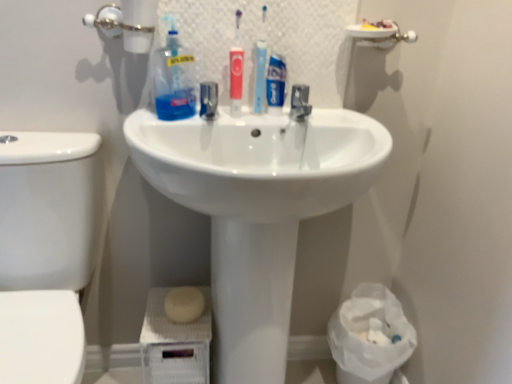
The width and height of the screenshot is (512, 384). What do you see at coordinates (370, 336) in the screenshot? I see `white plastic bag at lower right` at bounding box center [370, 336].

Locate an element on the screen. The width and height of the screenshot is (512, 384). transparent plastic toothbrushes at upper center is located at coordinates (268, 41).

The image size is (512, 384). What do you see at coordinates (175, 343) in the screenshot?
I see `white matte soap at lower center` at bounding box center [175, 343].

Locate an element on the screen. metallic faucet at center is located at coordinates (300, 103).

Image resolution: width=512 pixels, height=384 pixels. What are the coordinates of `white glossy sink at center` in the screenshot? It's located at (257, 210).

Where is `white plastic bag at lower right`? The width and height of the screenshot is (512, 384). white plastic bag at lower right is located at coordinates (370, 336).

From a real-world perspective, is transparent plastic toothbrushes at upper center physically located above or below translucent plastic bottle at upper center?

Clearly, from a real-world perspective, transparent plastic toothbrushes at upper center is above translucent plastic bottle at upper center.

Is point (288, 72) behind point (176, 100)?

Yes, it is behind point (176, 100).

Between transparent plastic toothbrushes at upper center and translucent plastic bottle at upper center, which one has larger width?

Wider between the two is translucent plastic bottle at upper center.

Considering the relative sizes of transparent plastic toothbrushes at upper center and translucent plastic bottle at upper center in the image provided, is transparent plastic toothbrushes at upper center shorter than translucent plastic bottle at upper center?

→ In fact, transparent plastic toothbrushes at upper center may be taller than translucent plastic bottle at upper center.

Is white glossy sink at center at the back of transparent plastic toothbrushes at upper center?

No.

Is transparent plastic toothbrushes at upper center far away from white glossy sink at center?

transparent plastic toothbrushes at upper center is actually quite close to white glossy sink at center.

Does transparent plastic toothbrushes at upper center contain white glossy sink at center?

That's incorrect, white glossy sink at center is not inside transparent plastic toothbrushes at upper center.

Between transparent plastic toothbrushes at upper center and white glossy sink at center, which one has larger size?

white glossy sink at center is bigger.

From the image's perspective, which is below, blue matte toothpaste tube at center or matte red toothbrush at center?

blue matte toothpaste tube at center is shown below in the image.

Can you confirm if blue matte toothpaste tube at center is positioned to the left of matte red toothbrush at center?

No, blue matte toothpaste tube at center is not to the left of matte red toothbrush at center.

In the scene shown: Can you confirm if blue matte toothpaste tube at center is shorter than matte red toothbrush at center?

Correct, blue matte toothpaste tube at center is not as tall as matte red toothbrush at center.

From the image's perspective, is white matte soap at lower center positioned above or below white glossy sink at center?

From the image's perspective, white matte soap at lower center appears below white glossy sink at center.

Locate an element on the screen. The height and width of the screenshot is (384, 512). sink above the white matte soap at lower center (from a real-world perspective) is located at coordinates (257, 210).

Does white matte soap at lower center have a greater height compared to white glossy sink at center?

No, white matte soap at lower center is not taller than white glossy sink at center.

Who is bigger, white matte soap at lower center or white glossy sink at center?

Bigger between the two is white glossy sink at center.

In the image, is white matte soap at lower center positioned in front of or behind white plastic bag at lower right?

Clearly, white matte soap at lower center is in front of white plastic bag at lower right.

From their relative heights in the image, would you say white matte soap at lower center is taller or shorter than white plastic bag at lower right?

In the image, white matte soap at lower center appears to be taller than white plastic bag at lower right.

Is white matte soap at lower center bigger or smaller than white plastic bag at lower right?

Clearly, white matte soap at lower center is smaller in size than white plastic bag at lower right.

From the image's perspective, is white matte soap at lower center over white plastic bag at lower right?

Yes, from the image's perspective, white matte soap at lower center is over white plastic bag at lower right.

How different are the orientations of matte red toothbrush at center and beige sponge at lower center in degrees?

matte red toothbrush at center and beige sponge at lower center are facing 8.38 degrees away from each other.

Is matte red toothbrush at center oriented towards beige sponge at lower center?

No, matte red toothbrush at center does not turn towards beige sponge at lower center.

Considering the points (231, 99) and (185, 302), which point is behind, point (231, 99) or point (185, 302)?

The point (185, 302) is farther from the camera.

Is matte red toothbrush at center not close to beige sponge at lower center?

No, there isn't a large distance between matte red toothbrush at center and beige sponge at lower center.

From a real-world perspective, is translucent plastic bottle at upper center on top of white matte soap at lower center?

Indeed, from a real-world perspective, translucent plastic bottle at upper center stands above white matte soap at lower center.

How many degrees apart are the facing directions of translucent plastic bottle at upper center and white matte soap at lower center?

8.37 degrees.

Based on the photo, who is shorter, translucent plastic bottle at upper center or white matte soap at lower center?

translucent plastic bottle at upper center.

The height and width of the screenshot is (384, 512). Identify the location of cleaning product below the transparent plastic toothbrushes at upper center (from the image's perspective). (173, 78).

At what (x,y) coordinates should I click in order to perform the action: click on mirror that is above the white glossy sink at center (from a real-world perspective). Please return your answer as a coordinate pair (x, y). Looking at the image, I should click on (268, 41).

When comparing their distances from translucent plastic bottle at upper center, does white matte soap at lower center or white glossy toilet bowl at left seem closer?

white glossy toilet bowl at left.

Based on their spatial positions, is matte red toothbrush at center or white plastic bag at lower right closer to white matte soap at lower center?

The object closer to white matte soap at lower center is white plastic bag at lower right.

Looking at the image, which one is located closer to matte red toothbrush at center, white glossy toilet bowl at left or beige sponge at lower center?

white glossy toilet bowl at left lies closer to matte red toothbrush at center than the other object.

Estimate the real-world distances between objects in this image. Which object is closer to white matte soap at lower center, beige sponge at lower center or blue matte toothpaste tube at center?

beige sponge at lower center is closer to white matte soap at lower center.

Looking at the image, which one is located further to blue matte toothpaste tube at center, white glossy sink at center or white glossy toilet bowl at left?

white glossy toilet bowl at left lies further to blue matte toothpaste tube at center than the other object.

Looking at this image, which object lies further to the anchor point translucent plastic bottle at upper center, beige sponge at lower center or blue matte toothpaste tube at center?

Based on the image, beige sponge at lower center appears to be further to translucent plastic bottle at upper center.

Looking at this image, from the image, which object appears to be nearer to blue matte toothpaste tube at center, transparent plastic toothbrushes at upper center or translucent plastic bottle at upper center?

transparent plastic toothbrushes at upper center.

Based on their spatial positions, is metallic faucet at center or transparent plastic toothbrushes at upper center further from beige sponge at lower center?

transparent plastic toothbrushes at upper center lies further to beige sponge at lower center than the other object.

Image resolution: width=512 pixels, height=384 pixels. Find the location of `toilet bowl that lies between translucent plastic bottle at upper center and white matte soap at lower center from top to bottom`. toilet bowl that lies between translucent plastic bottle at upper center and white matte soap at lower center from top to bottom is located at coordinates (46, 251).

Locate an element on the screen. personal care that lies between matte red toothbrush at center and white matte soap at lower center from top to bottom is located at coordinates (276, 81).

The image size is (512, 384). Find the location of `personal care between translucent plastic bottle at upper center and white glossy sink at center from top to bottom`. personal care between translucent plastic bottle at upper center and white glossy sink at center from top to bottom is located at coordinates 276,81.

Find the location of a particular element. The height and width of the screenshot is (384, 512). mirror between translucent plastic bottle at upper center and blue matte toothpaste tube at center in the horizontal direction is located at coordinates (268, 41).